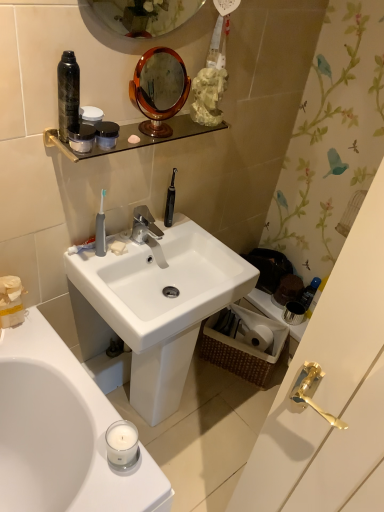
This screenshot has height=512, width=384. In order to click on unoccupied space behind silver metallic faucet at center in this screenshot , I will do `click(167, 228)`.